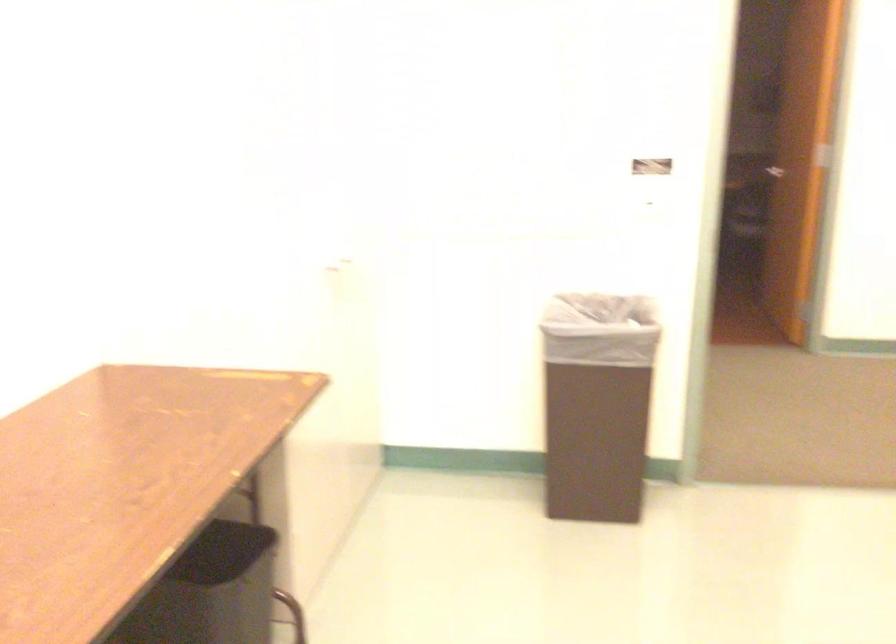
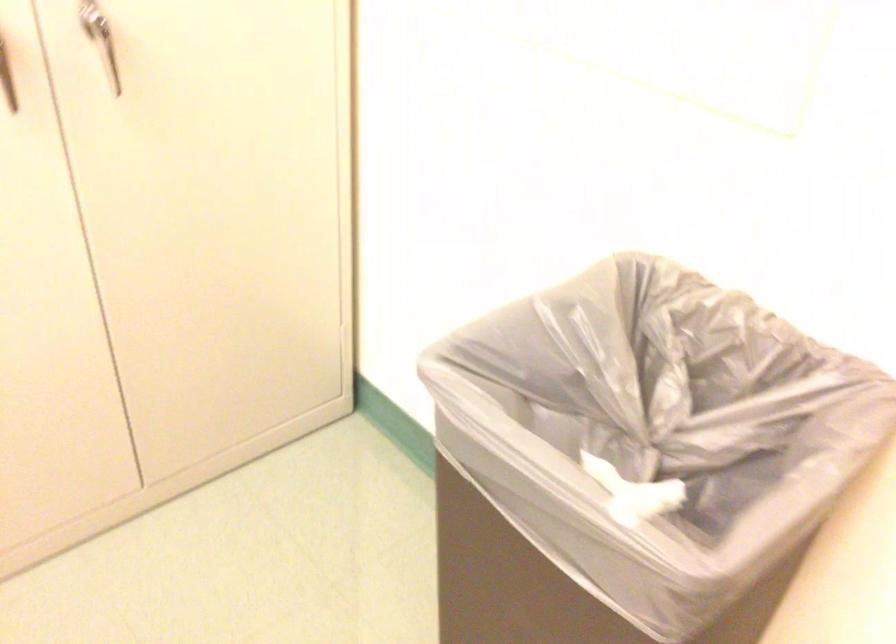
The point at (313, 283) is marked in the first image. Where is the corresponding point in the second image?

(6, 79)